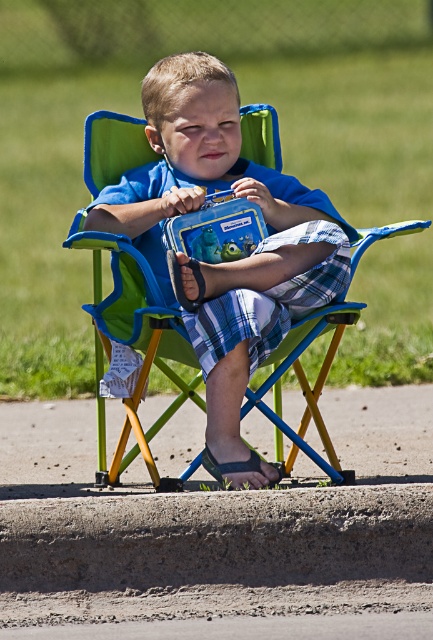
Which object is bigger between the blue fabric boy at center and the black fabric sandal at lower center?

The blue fabric boy at center is larger in size than the black fabric sandal at lower center.

A parent wants to ensure their child can easily reach their sandal without getting up from the chair. Given the distance between the blue fabric boy at center and the black fabric sandal at lower center, is this possible?

The blue fabric boy at center and black fabric sandal at lower center are 3.52 feet apart, so the child would need to stretch or get up to reach the sandal, making it difficult to do so without moving.